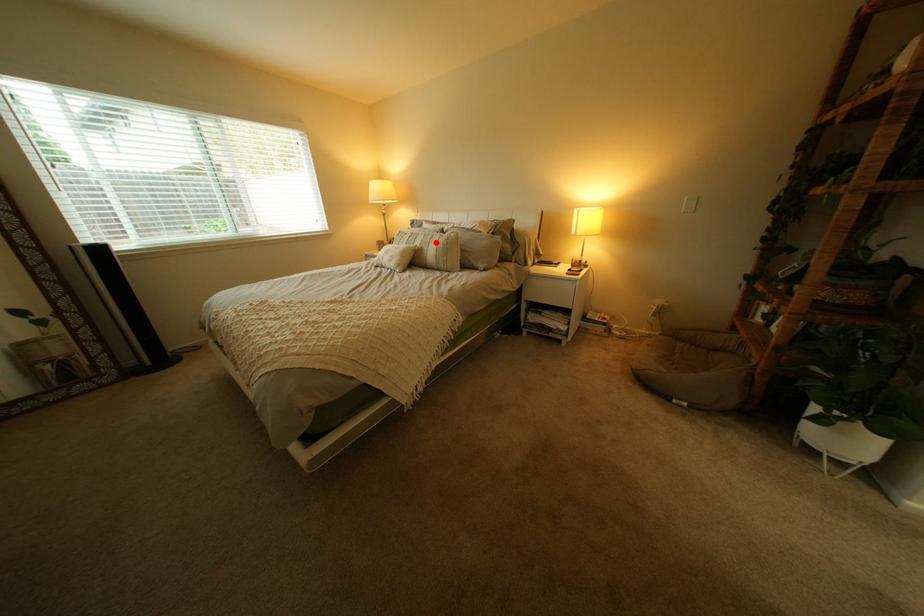
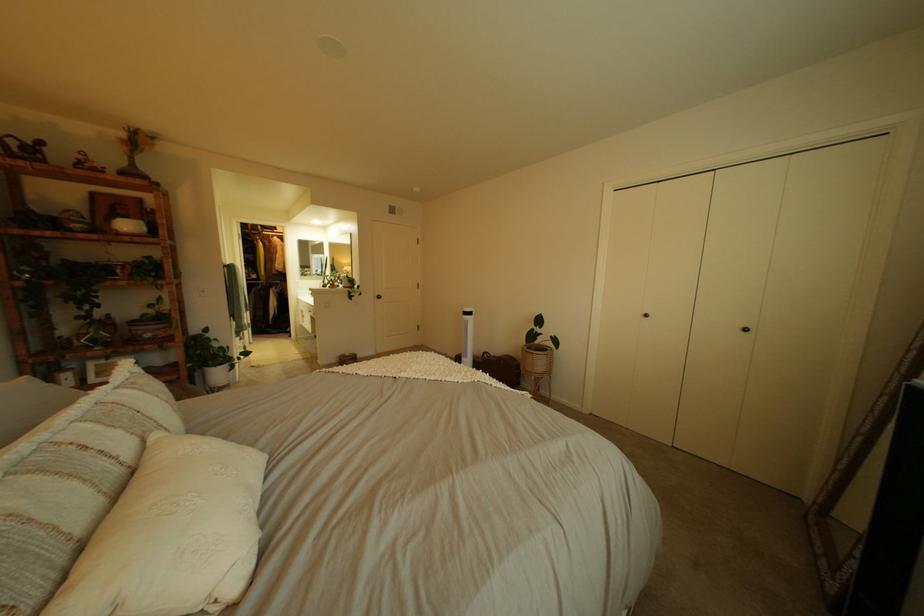
Locate, in the second image, the point that corresponds to the highlighted location in the first image.

(134, 434)